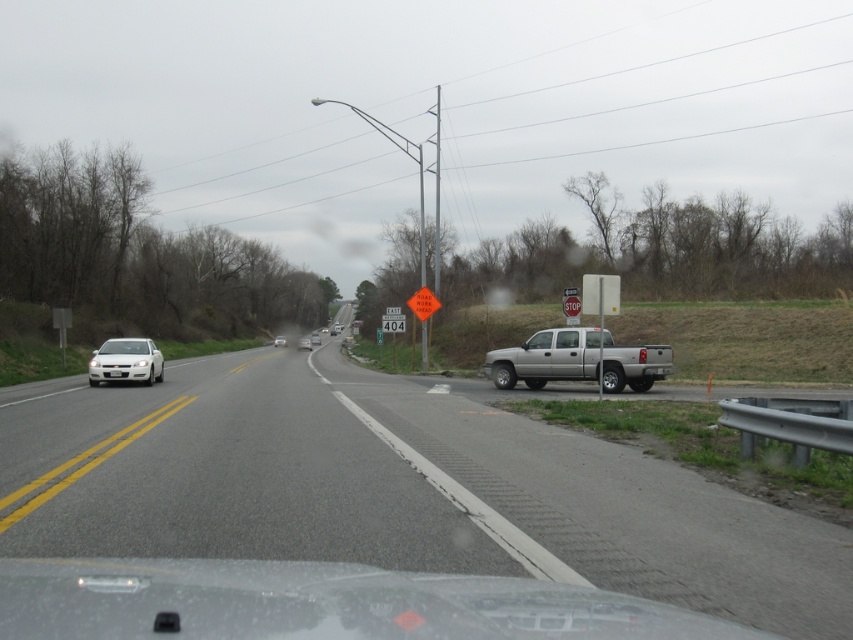
Between gray asphalt road at center and white matte sedan at center, which one is positioned lower?

gray asphalt road at center

Does gray asphalt road at center appear under white matte sedan at center?

Yes, gray asphalt road at center is below white matte sedan at center.

Does point (448, 554) come in front of point (302, 337)?

That is True.

Where is `gray asphalt road at center`? This screenshot has width=853, height=640. gray asphalt road at center is located at coordinates 396,488.

From the picture: Which is below, white matte sedan at left or white glossy windshield at left?

white matte sedan at left

What do you see at coordinates (126, 362) in the screenshot? I see `white matte sedan at left` at bounding box center [126, 362].

Where is `white matte sedan at left`? This screenshot has width=853, height=640. white matte sedan at left is located at coordinates (126, 362).

Is clear glass windshield at right to the left of white glossy sedan at center from the viewer's perspective?

In fact, clear glass windshield at right is to the right of white glossy sedan at center.

Describe the element at coordinates (538, 340) in the screenshot. I see `clear glass windshield at right` at that location.

The width and height of the screenshot is (853, 640). In order to click on clear glass windshield at right in this screenshot , I will do `click(538, 340)`.